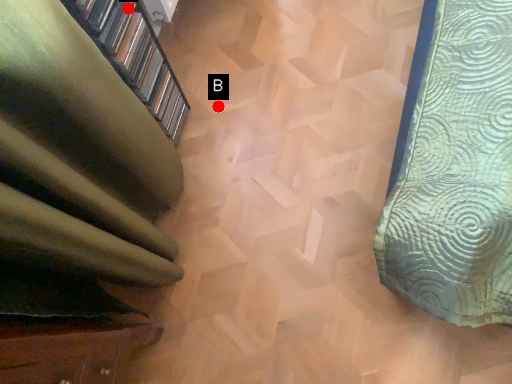
Question: Two points are circled on the image, labeled by A and B beside each circle. Which of the following is the farthest from the observer?

Choices:
 (A) A is further
 (B) B is further

Answer: (B)